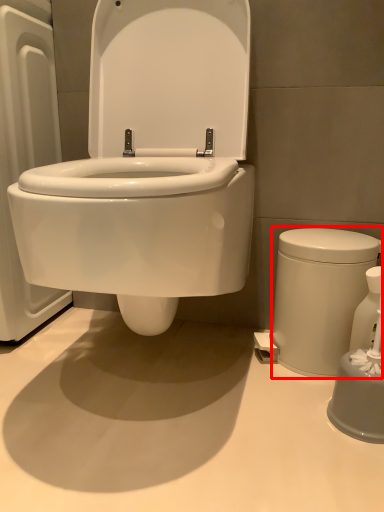
Question: From the image's perspective, where is porcelain (annotated by the red box) located relative to soap dispenser?

Choices:
 (A) above
 (B) below

Answer: (A)